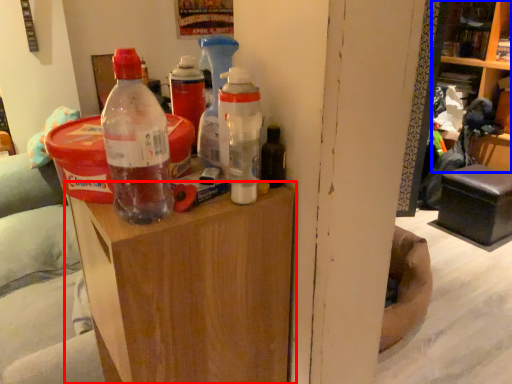
Question: Among these objects, which one is nearest to the camera, furniture (highlighted by a red box) or shelf (highlighted by a blue box)?

Choices:
 (A) furniture
 (B) shelf

Answer: (A)